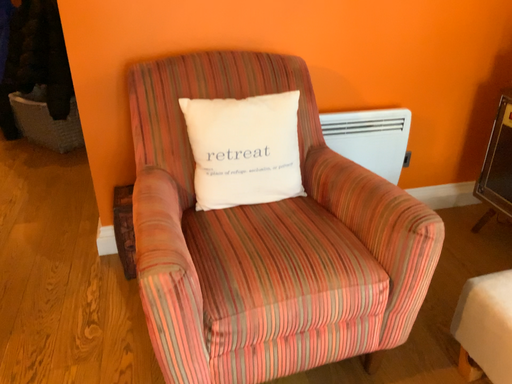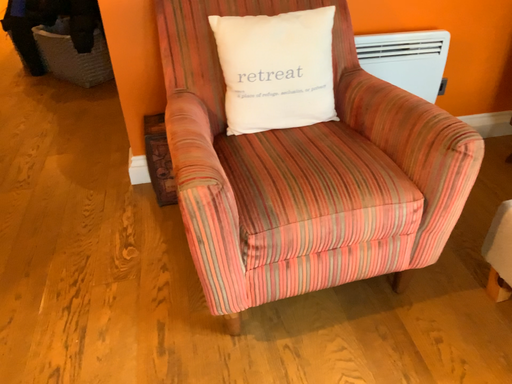
Question: How did the camera likely rotate when shooting the video?

Choices:
 (A) rotated downward
 (B) rotated upward

Answer: (A)